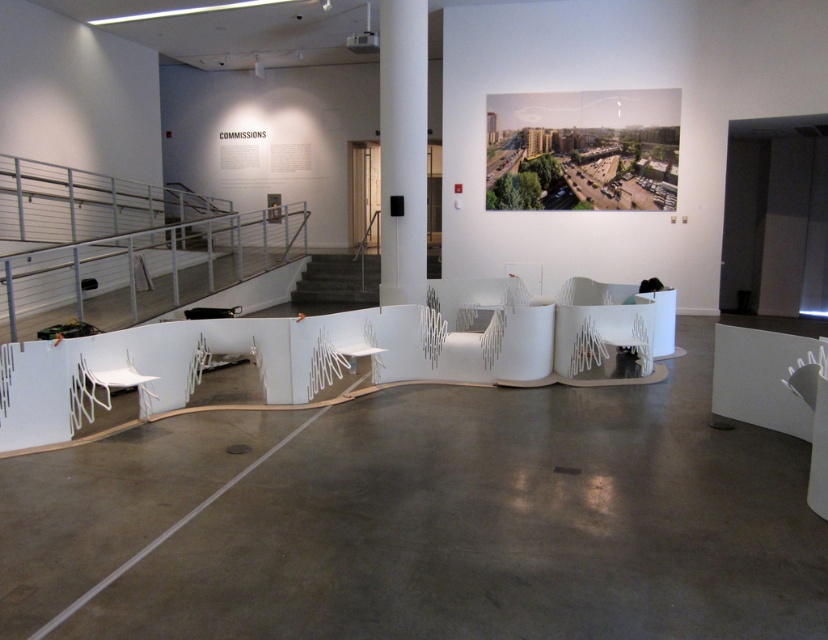
Question: Which point is farther from the camera taking this photo?

Choices:
 (A) (402, 200)
 (B) (514, 276)

Answer: (B)

Question: Considering the relative positions of white plastic chair at center and white matte chair at center in the image provided, where is white plastic chair at center located with respect to white matte chair at center?

Choices:
 (A) below
 (B) above

Answer: (A)

Question: Which of the following is the closest to the observer?

Choices:
 (A) (402, 177)
 (B) (130, 372)
 (C) (629, 316)

Answer: (B)

Question: Which of the following is the farthest from the observer?

Choices:
 (A) white matte column at center
 (B) white matte chair at center
 (C) white plastic chair at center

Answer: (B)

Question: Is white matte chair at lower left above white matte chair at center?

Choices:
 (A) yes
 (B) no

Answer: (B)

Question: Is dark gray concrete stairs at center positioned at the back of white matte chair at center?

Choices:
 (A) yes
 (B) no

Answer: (A)